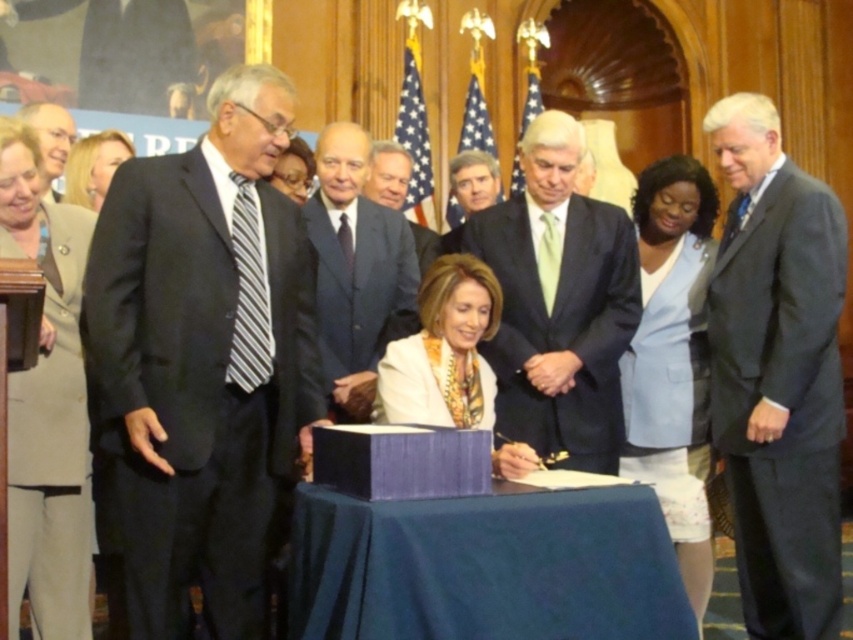
Can you confirm if light blue fabric dress at right is shorter than white silk blouse at center?

Correct, light blue fabric dress at right is not as tall as white silk blouse at center.

What do you see at coordinates (672, 360) in the screenshot? The width and height of the screenshot is (853, 640). I see `light blue fabric dress at right` at bounding box center [672, 360].

Who is more distant from viewer, (717, 196) or (440, 280)?

The point (717, 196) is behind.

This screenshot has height=640, width=853. In order to click on light blue fabric dress at right in this screenshot , I will do `click(672, 360)`.

Image resolution: width=853 pixels, height=640 pixels. Describe the element at coordinates (485, 566) in the screenshot. I see `blue fabric table at center` at that location.

Does point (523, 576) come farther from viewer compared to point (326, 148)?

No, it is not.

Who is more distant from viewer, (526, 493) or (350, 296)?

Point (350, 296)

At what (x,y) coordinates should I click in order to perform the action: click on blue fabric table at center. Please return your answer as a coordinate pair (x, y). The height and width of the screenshot is (640, 853). Looking at the image, I should click on (485, 566).

Based on the photo, is black striped tie at left bigger than dark gray suit at right?

Indeed, black striped tie at left has a larger size compared to dark gray suit at right.

The image size is (853, 640). Identify the location of black striped tie at left. (202, 358).

You are a GUI agent. You are given a task and a screenshot of the screen. Output one action in this format:
    pyautogui.click(x=<x>, y=<y>)
    Task: Click on the black striped tie at left
    The image size is (853, 640).
    Given the screenshot: What is the action you would take?
    pyautogui.click(x=202, y=358)